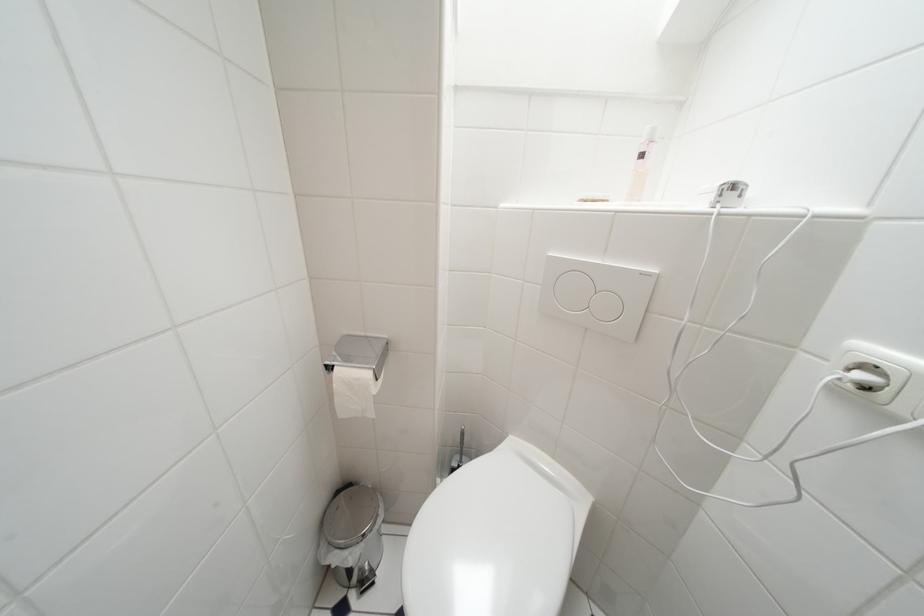
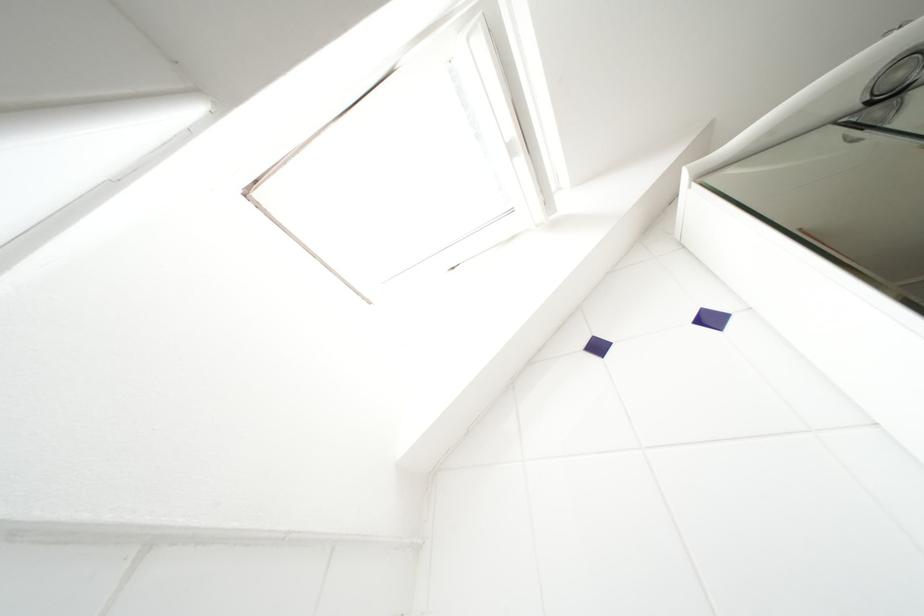
The images are taken continuously from a first-person perspective. In which direction is your viewpoint rotating?

The camera's rotation is toward right-up.